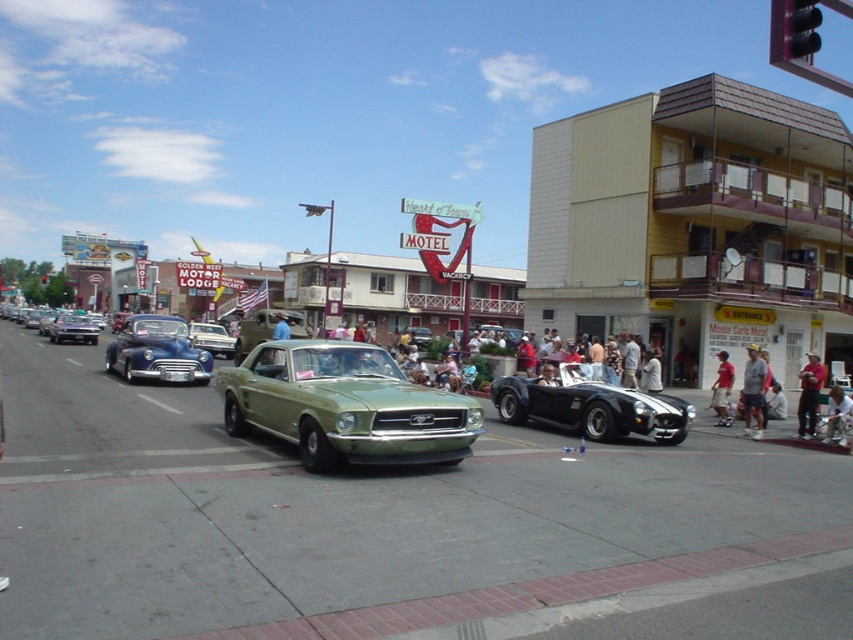
Does shiny blue car at left have a lesser width compared to gray fabric cap at lower right?

In fact, shiny blue car at left might be wider than gray fabric cap at lower right.

Is the position of shiny blue car at left more distant than that of gray fabric cap at lower right?

Yes, shiny blue car at left is behind gray fabric cap at lower right.

Does point (142, 364) come closer to viewer compared to point (764, 360)?

No, it is not.

Image resolution: width=853 pixels, height=640 pixels. I want to click on shiny blue car at left, so click(157, 352).

From the picture: Does black plastic traffic light at upper right lie behind light brown leather shorts at lower right?

No, black plastic traffic light at upper right is closer to the viewer.

Does black plastic traffic light at upper right appear under light brown leather shorts at lower right?

Incorrect, black plastic traffic light at upper right is not positioned below light brown leather shorts at lower right.

Is point (788, 44) behind point (718, 424)?

No.

This screenshot has height=640, width=853. What are the coordinates of `black plastic traffic light at upper right` in the screenshot? It's located at (799, 29).

Who is more distant from viewer, (155, 342) or (798, 426)?

The point (155, 342) is more distant.

Is point (132, 365) positioned before point (814, 412)?

No, (132, 365) is behind (814, 412).

This screenshot has width=853, height=640. In order to click on shiny blue car at left in this screenshot , I will do `click(157, 352)`.